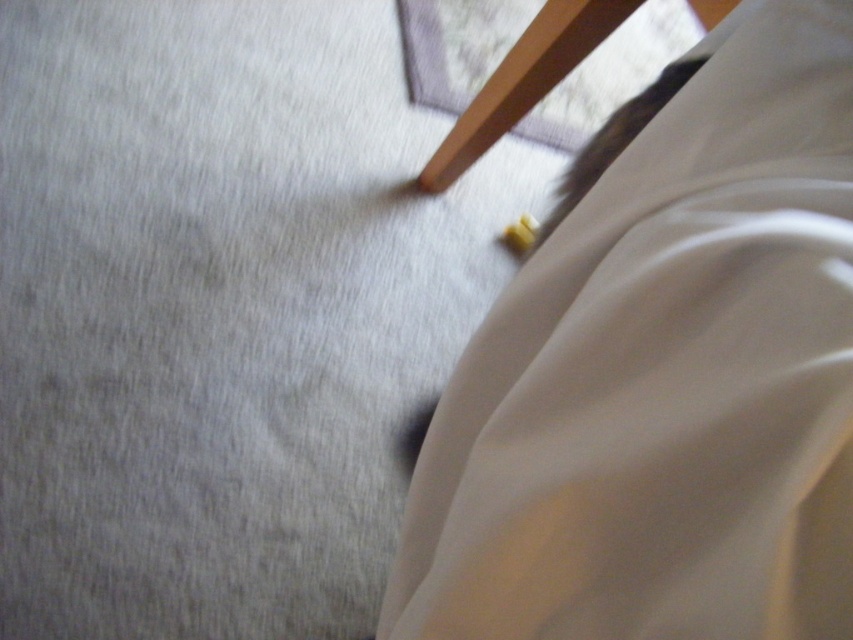
Question: Which of the following is the farthest from the observer?

Choices:
 (A) (809, 381)
 (B) (549, 36)

Answer: (B)

Question: Which point is farther from the camera taking this photo?

Choices:
 (A) (531, 29)
 (B) (445, 532)

Answer: (A)

Question: Is beige satin sheet at lower right positioned in front of wooden chair at upper center?

Choices:
 (A) no
 (B) yes

Answer: (B)

Question: Is beige satin sheet at lower right closer to the viewer compared to wooden chair at upper center?

Choices:
 (A) yes
 (B) no

Answer: (A)

Question: Which point is farther to the camera?

Choices:
 (A) wooden chair at upper center
 (B) beige satin sheet at lower right

Answer: (A)

Question: Does beige satin sheet at lower right have a lesser width compared to wooden chair at upper center?

Choices:
 (A) yes
 (B) no

Answer: (A)